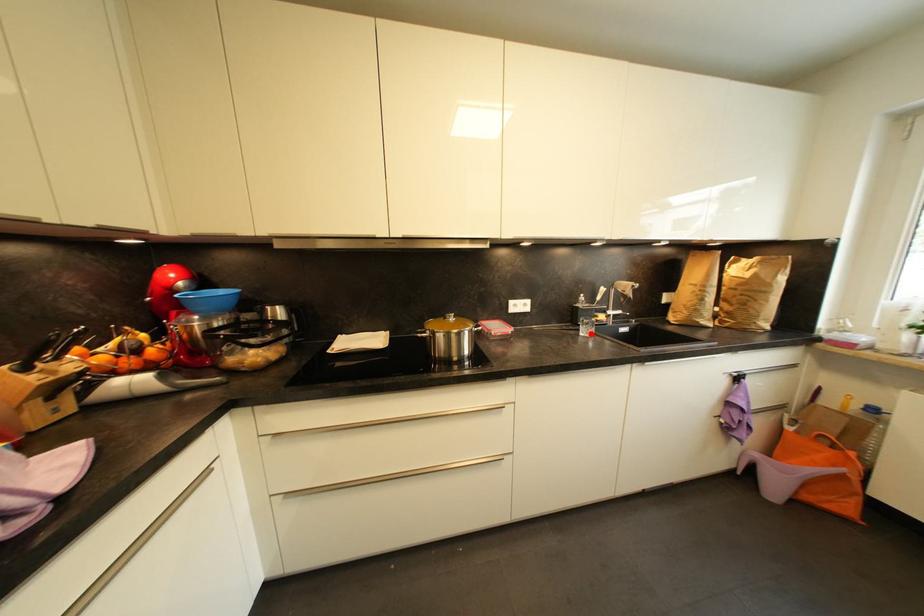
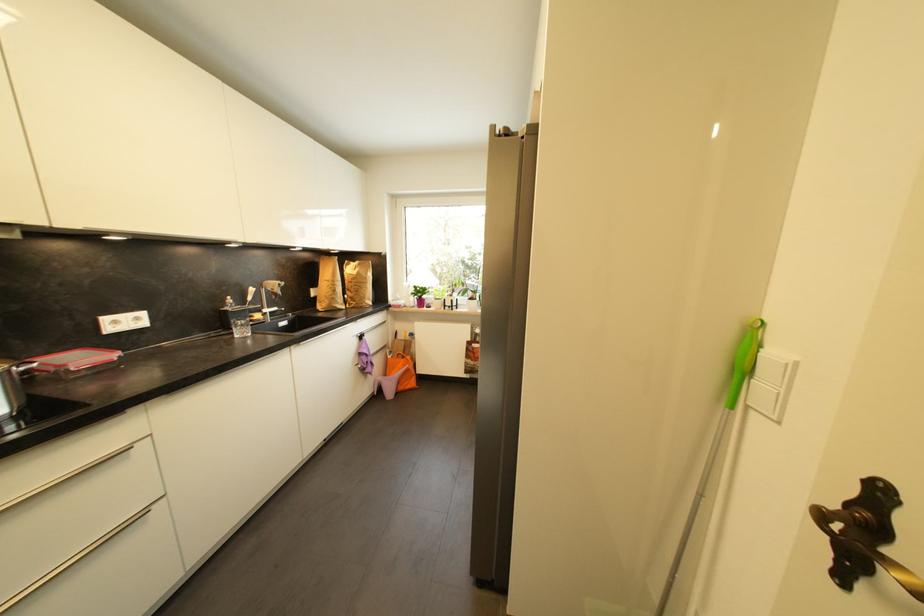
Locate, in the second image, the point that corresponds to the highlighted location in the first image.

(247, 334)